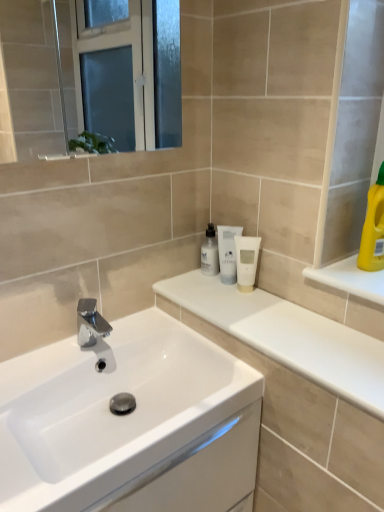
Locate an element on the screen. Image resolution: width=384 pixels, height=512 pixels. free space in front of transparent plastic bottle at center, marked as the second mouthwash in a left-to-right arrangement is located at coordinates (240, 306).